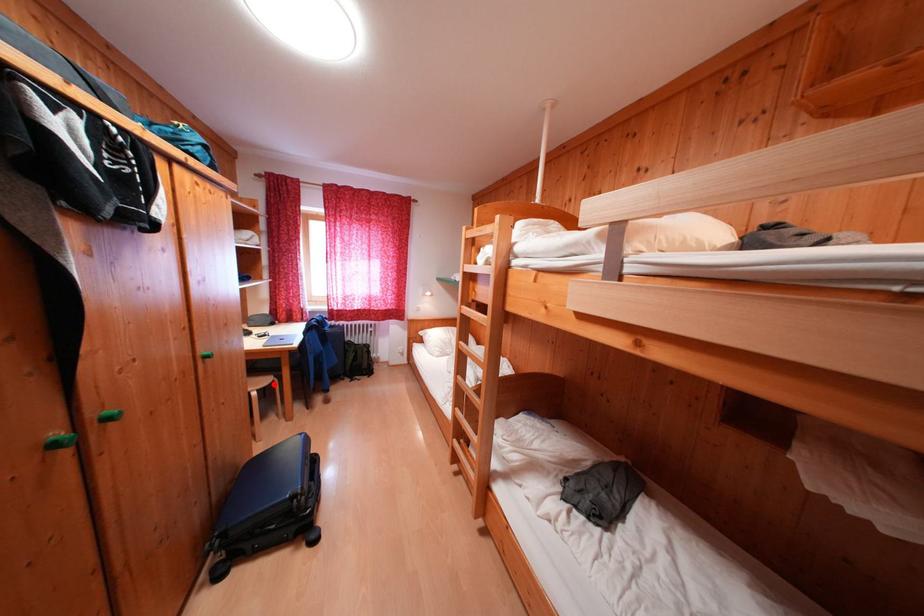
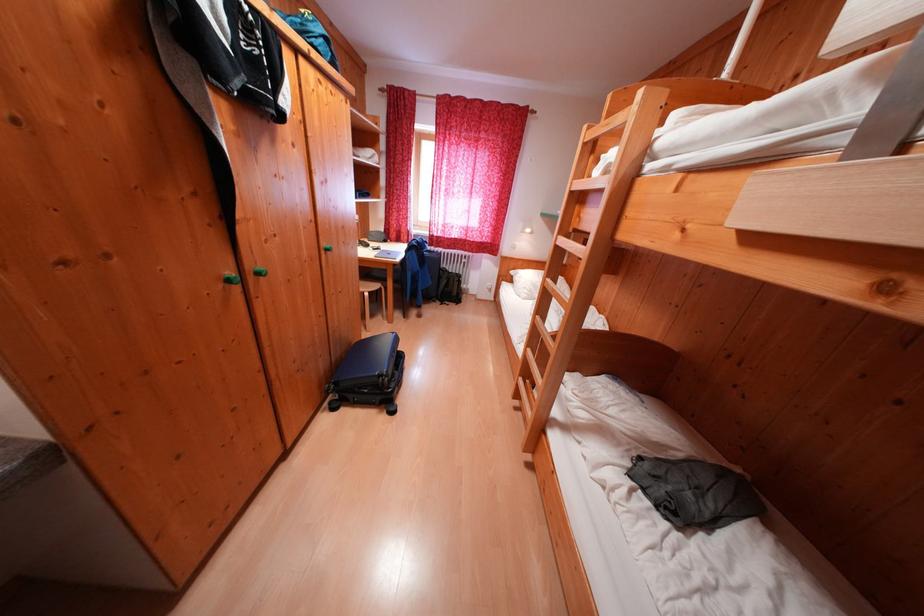
Find the pixel in the second image that matches the highlighted location in the first image.

(383, 290)